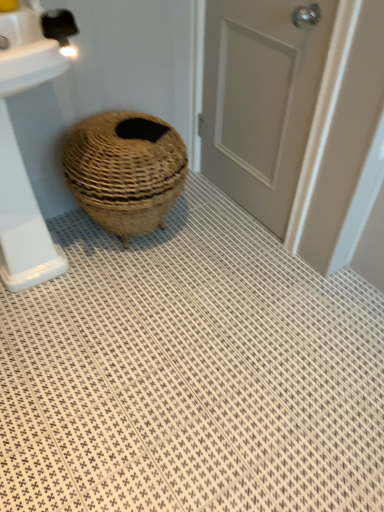
Identify the location of vacant space in front of matte gray door at center. This screenshot has height=512, width=384. (231, 263).